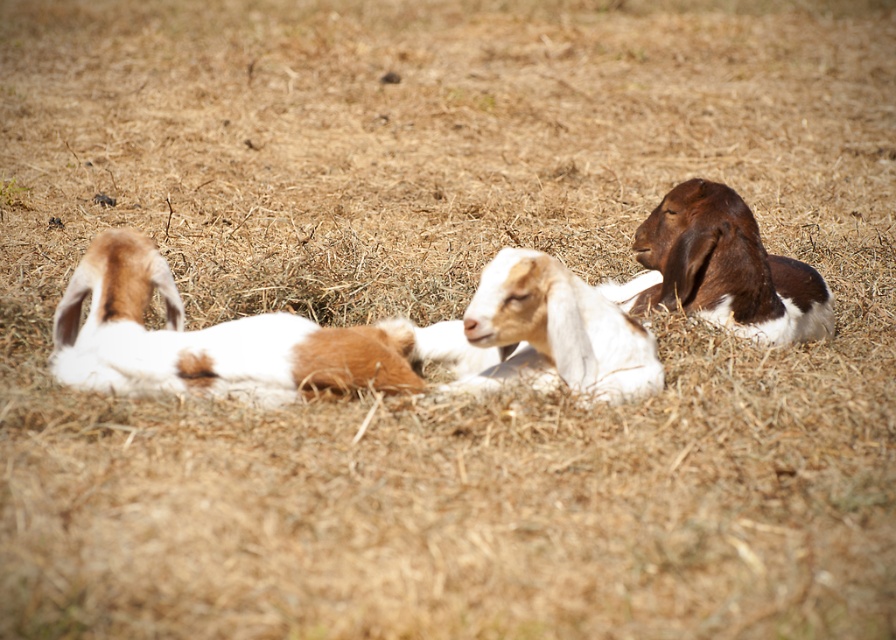
Question: Observing the image, what is the correct spatial positioning of brown and white fur goat at left in reference to white woolen goat at center?

Choices:
 (A) above
 (B) below

Answer: (A)

Question: Which of these objects is positioned closest to the brown and white fur at right?

Choices:
 (A) white woolen goat at center
 (B) brown and white fur goat at left

Answer: (A)

Question: Which point is farther from the camera taking this photo?

Choices:
 (A) (228, 384)
 (B) (582, 324)

Answer: (B)

Question: Is brown and white fur goat at left further to the viewer compared to brown and white fur at right?

Choices:
 (A) yes
 (B) no

Answer: (B)

Question: Which of these objects is positioned farthest from the white woolen goat at center?

Choices:
 (A) brown and white fur at right
 (B) brown and white fur goat at left

Answer: (A)

Question: Is brown and white fur goat at left wider than brown and white fur at right?

Choices:
 (A) yes
 (B) no

Answer: (A)